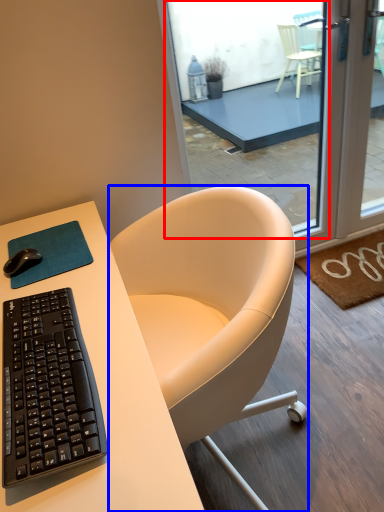
Question: Which object appears closest to the camera in this image, window (highlighted by a red box) or chair (highlighted by a blue box)?

Choices:
 (A) window
 (B) chair

Answer: (B)